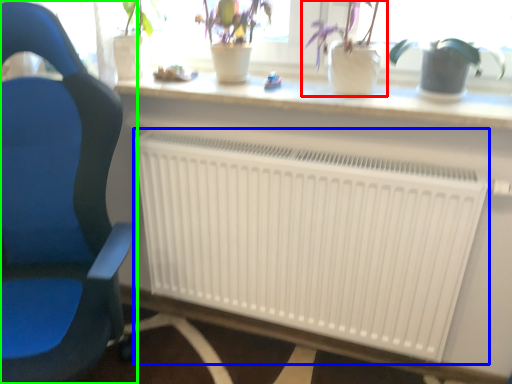
Question: Which is farther away from houseplant (highlighted by a red box)? radiator (highlighted by a blue box) or chair (highlighted by a green box)?

Choices:
 (A) radiator
 (B) chair

Answer: (B)